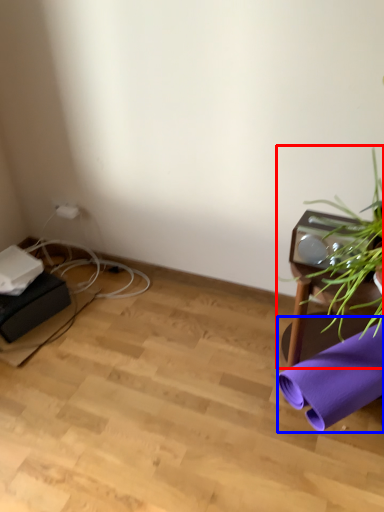
Question: Which object is further to the camera taking this photo, houseplant (highlighted by a red box) or beach towel (highlighted by a blue box)?

Choices:
 (A) houseplant
 (B) beach towel

Answer: (B)